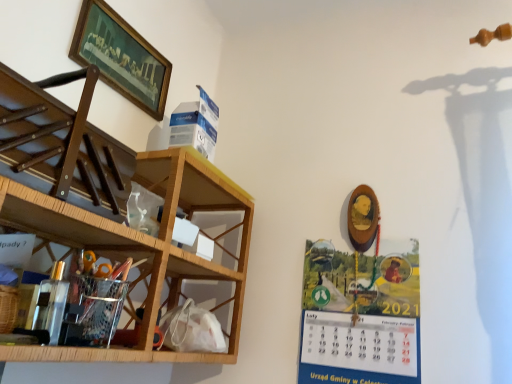
Question: In terms of size, does wooden framed painting at upper left appear bigger or smaller than metallic calendar at right?

Choices:
 (A) big
 (B) small

Answer: (B)

Question: Is point (74, 59) closer or farther from the camera than point (373, 344)?

Choices:
 (A) closer
 (B) farther

Answer: (A)

Question: Which object is positioned closest to the wooden at left, the second shelf in the bottom-to-top sequence?

Choices:
 (A) metallic calendar at right
 (B) wooden at left, the 3th shelf positioned from the bottom
 (C) metallic silver organizer at lower left, the third shelf from the top
 (D) wooden framed painting at upper left

Answer: (C)

Question: Which of these objects is positioned closest to the metallic silver organizer at lower left, the third shelf from the top?

Choices:
 (A) wooden at left, the 3th shelf positioned from the bottom
 (B) wooden at left, the 2th shelf from the top
 (C) metallic calendar at right
 (D) wooden framed painting at upper left

Answer: (B)